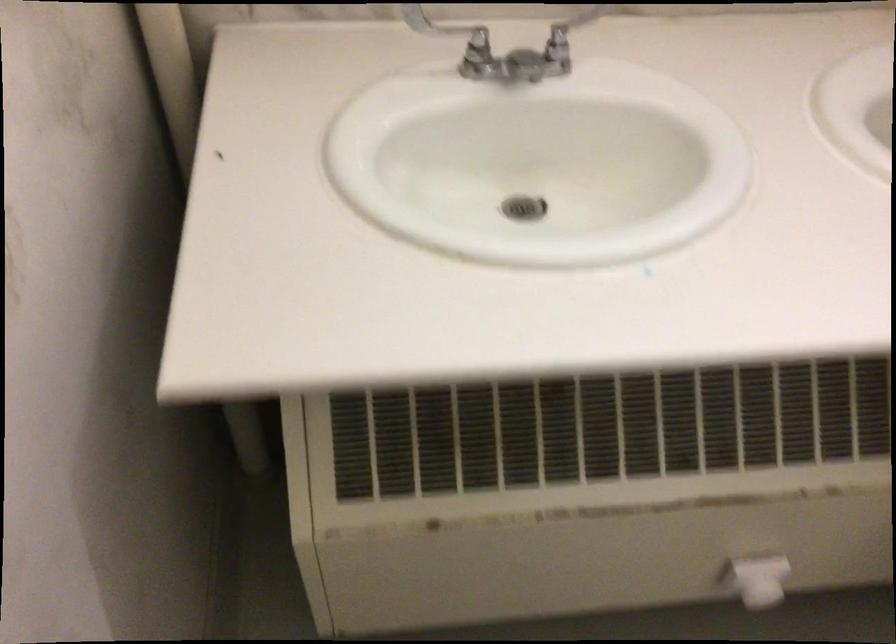
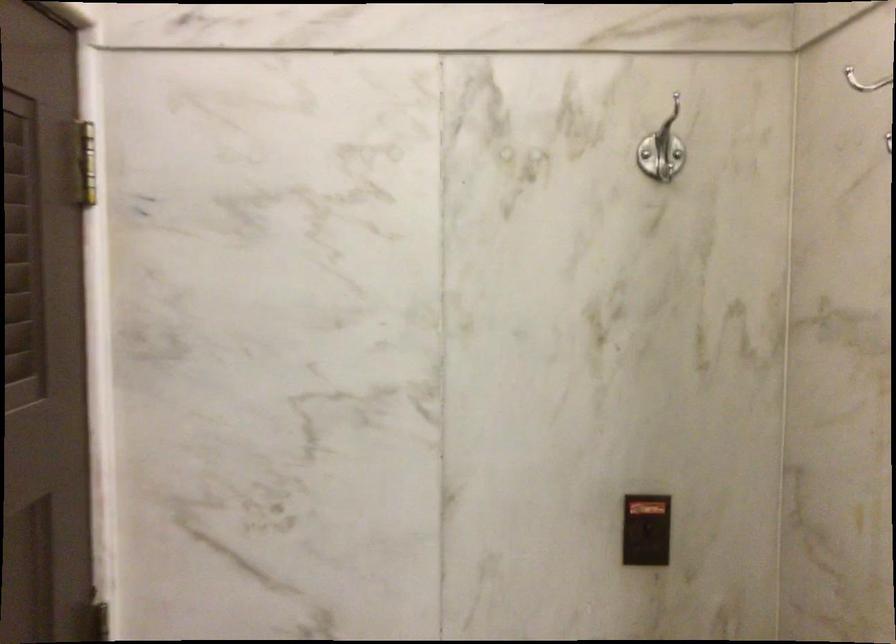
Question: Based on the continuous images, in which direction is the camera rotating? Reply with the corresponding letter.

Choices:
 (A) Left
 (B) Right
 (C) Up
 (D) Down

Answer: (A)